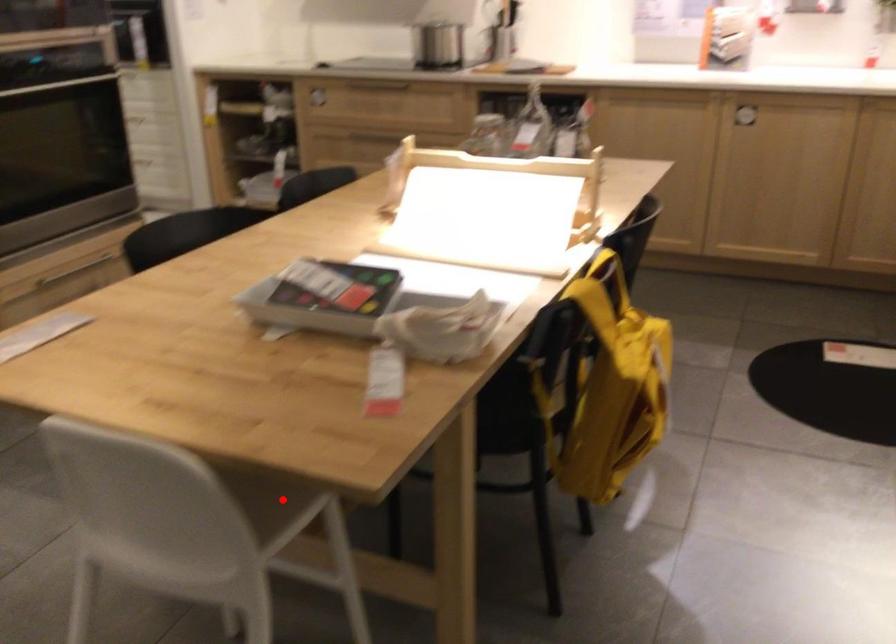
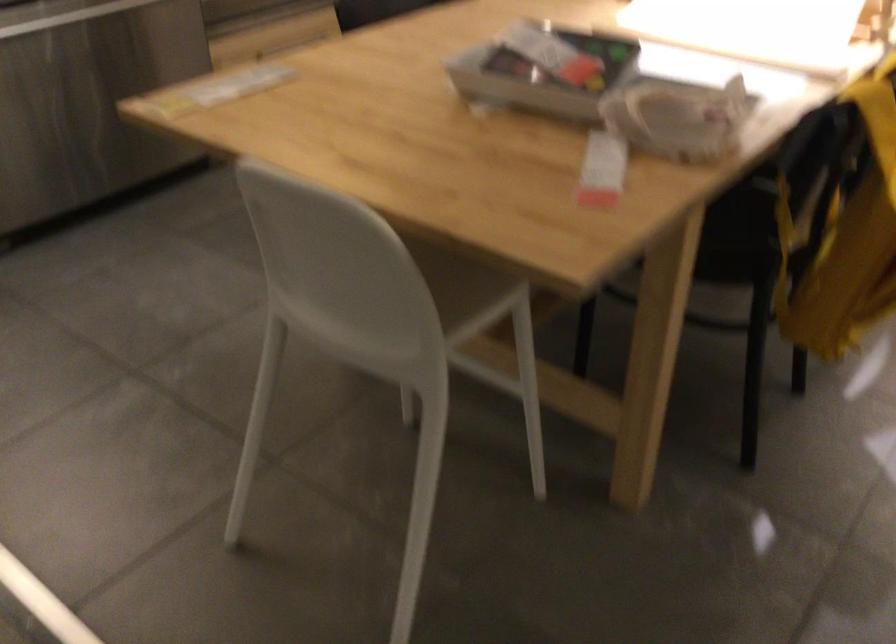
In the second image, find the point that corresponds to the highlighted location in the first image.

(468, 290)